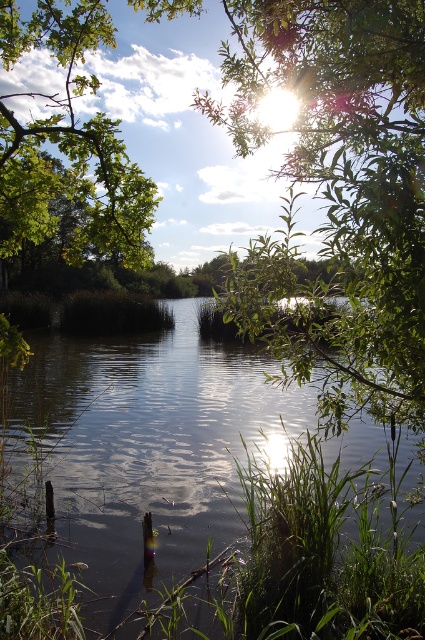
You are standing in the serene natural scene and want to take a photo. There are two points in the image labeled as point [251,259] and point [47,236]. Which point will appear larger in your photo?

Point [251,259] will appear larger in the photo because it is closer to the camera than point [47,236].

You are a photographer planning to capture the reflection of the green leafy tree at upper center in the smooth dark water at center. Given that the tree is 9.59 meters away from the water, will its reflection be visible in the water?

The smooth dark water at center and green leafy tree at upper center are 9.59 meters apart. Since the water is smooth, the reflection of the tree will be clearly visible as calm water surfaces can reflect objects even at that distance.